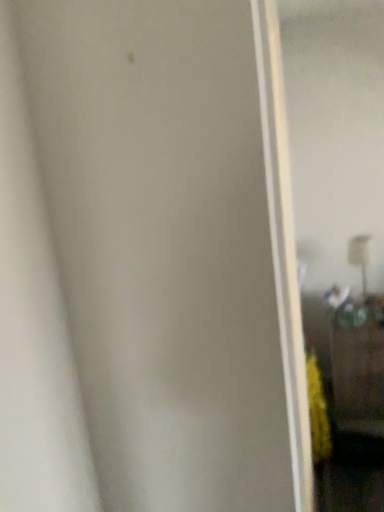
Describe the element at coordinates (358, 365) in the screenshot. I see `wooden cabinet at right` at that location.

This screenshot has height=512, width=384. In order to click on wooden cabinet at right in this screenshot , I will do `click(358, 365)`.

You are a GUI agent. You are given a task and a screenshot of the screen. Output one action in this format:
    pyautogui.click(x=<x>, y=<y>)
    Task: Click on the wooden cabinet at right
    
    Given the screenshot: What is the action you would take?
    pyautogui.click(x=358, y=365)